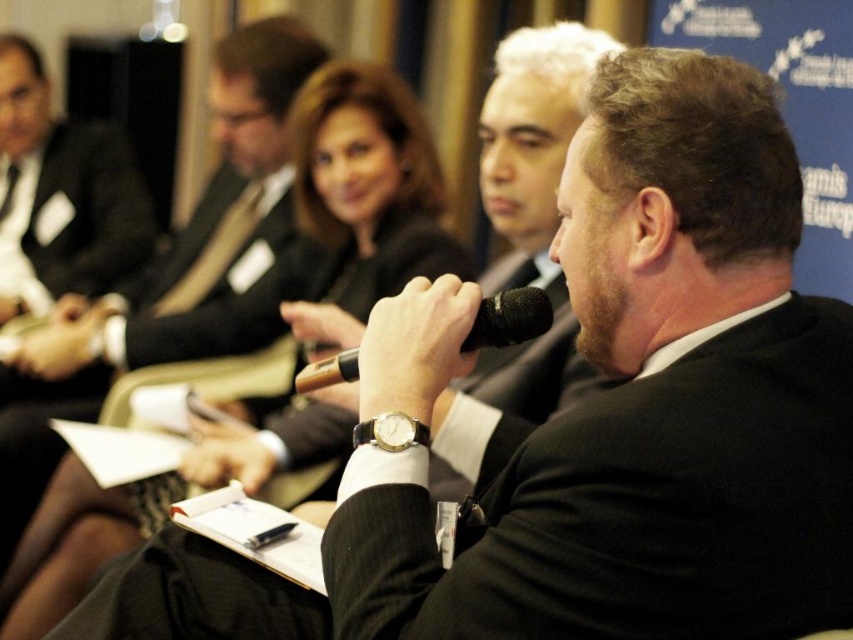
This screenshot has width=853, height=640. What do you see at coordinates (631, 506) in the screenshot?
I see `black matte suit at center` at bounding box center [631, 506].

Does black matte suit at center have a lesser height compared to gold metallic watch at center?

No.

Locate an element on the screen. The image size is (853, 640). black matte suit at center is located at coordinates (631, 506).

Describe the element at coordinates (204, 236) in the screenshot. This screenshot has width=853, height=640. I see `matte black suit at center` at that location.

Between matte black suit at center and gold metallic watch at center, which one has less height?

Standing shorter between the two is gold metallic watch at center.

Describe the element at coordinates (204, 236) in the screenshot. The image size is (853, 640). I see `matte black suit at center` at that location.

Identify the location of matte black suit at center. (204, 236).

Can you confirm if black matte suit at center is wider than matte black suit at left?

No.

Is black matte suit at center thinner than matte black suit at left?

Yes, black matte suit at center is thinner than matte black suit at left.

Is point (817, 532) less distant than point (38, 262)?

Yes, point (817, 532) is in front of point (38, 262).

What are the coordinates of `black matte suit at center` in the screenshot? It's located at (631, 506).